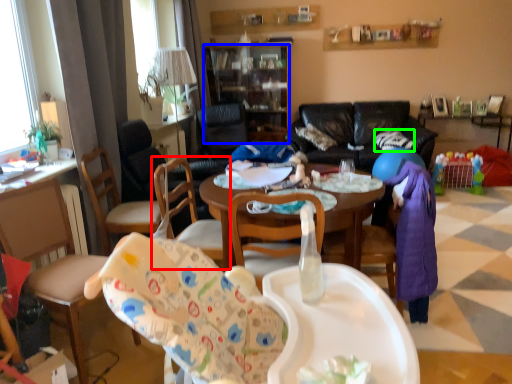
Question: Considering the real-world distances, which object is farthest from chair (highlighted by a red box)? cabinetry (highlighted by a blue box) or pillow (highlighted by a green box)?

Choices:
 (A) cabinetry
 (B) pillow

Answer: (A)